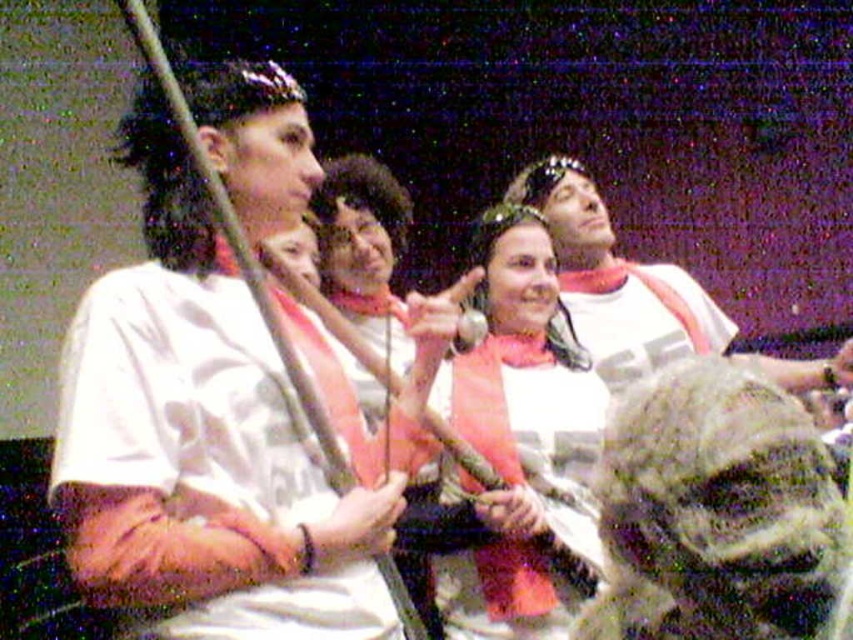
Question: Is white matte shirt at upper center to the right of camo fabric shirt at center from the viewer's perspective?

Choices:
 (A) yes
 (B) no

Answer: (B)

Question: Does white matte shirt at center appear over matte black sword at center?

Choices:
 (A) yes
 (B) no

Answer: (B)

Question: Which point is farther from the camera taking this photo?

Choices:
 (A) (643, 308)
 (B) (248, 499)

Answer: (A)

Question: Is matte black sword at center to the right of white matte shirt at upper center from the viewer's perspective?

Choices:
 (A) yes
 (B) no

Answer: (B)

Question: Estimate the real-world distances between objects in this image. Which object is farther from the camo fabric shirt at center?

Choices:
 (A) white matte shirt at upper center
 (B) matte black sword at center

Answer: (B)

Question: Which object is closer to the camera taking this photo?

Choices:
 (A) matte black sword at center
 (B) white matte shirt at center

Answer: (B)